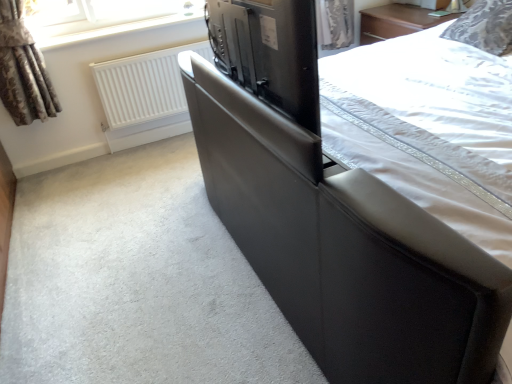
Question: Is matte black tv at center not inside white matte radiator at upper left?

Choices:
 (A) no
 (B) yes

Answer: (B)

Question: Is matte black tv at center smaller than white matte radiator at upper left?

Choices:
 (A) no
 (B) yes

Answer: (B)

Question: Can you confirm if matte black tv at center is thinner than white matte radiator at upper left?

Choices:
 (A) yes
 (B) no

Answer: (B)

Question: Is matte black tv at center directly adjacent to white matte radiator at upper left?

Choices:
 (A) no
 (B) yes

Answer: (A)

Question: Considering the relative positions of matte black tv at center and white matte radiator at upper left in the image provided, is matte black tv at center in front of white matte radiator at upper left?

Choices:
 (A) yes
 (B) no

Answer: (A)

Question: In the image, is white matte radiator at upper left positioned in front of or behind brown textured curtain at upper left?

Choices:
 (A) behind
 (B) front

Answer: (A)

Question: Do you think white matte radiator at upper left is within brown textured curtain at upper left, or outside of it?

Choices:
 (A) inside
 (B) outside

Answer: (B)

Question: Is white matte radiator at upper left wider or thinner than brown textured curtain at upper left?

Choices:
 (A) thin
 (B) wide

Answer: (A)

Question: Does point (150, 56) appear closer or farther from the camera than point (39, 51)?

Choices:
 (A) farther
 (B) closer

Answer: (A)

Question: In terms of width, does black leather bed at center look wider or thinner when compared to patterned fabric pillow at upper right?

Choices:
 (A) thin
 (B) wide

Answer: (B)

Question: Is point (479, 304) closer or farther from the camera than point (502, 51)?

Choices:
 (A) farther
 (B) closer

Answer: (B)

Question: Considering the relative positions of black leather bed at center and patterned fabric pillow at upper right in the image provided, is black leather bed at center to the left or to the right of patterned fabric pillow at upper right?

Choices:
 (A) left
 (B) right

Answer: (A)

Question: Considering the positions of black leather bed at center and patterned fabric pillow at upper right in the image, is black leather bed at center bigger or smaller than patterned fabric pillow at upper right?

Choices:
 (A) small
 (B) big

Answer: (B)

Question: From a real-world perspective, is white matte radiator at upper left above or below matte black tv at center?

Choices:
 (A) below
 (B) above

Answer: (A)

Question: Considering the positions of point (120, 71) and point (221, 18), is point (120, 71) closer or farther from the camera than point (221, 18)?

Choices:
 (A) farther
 (B) closer

Answer: (A)